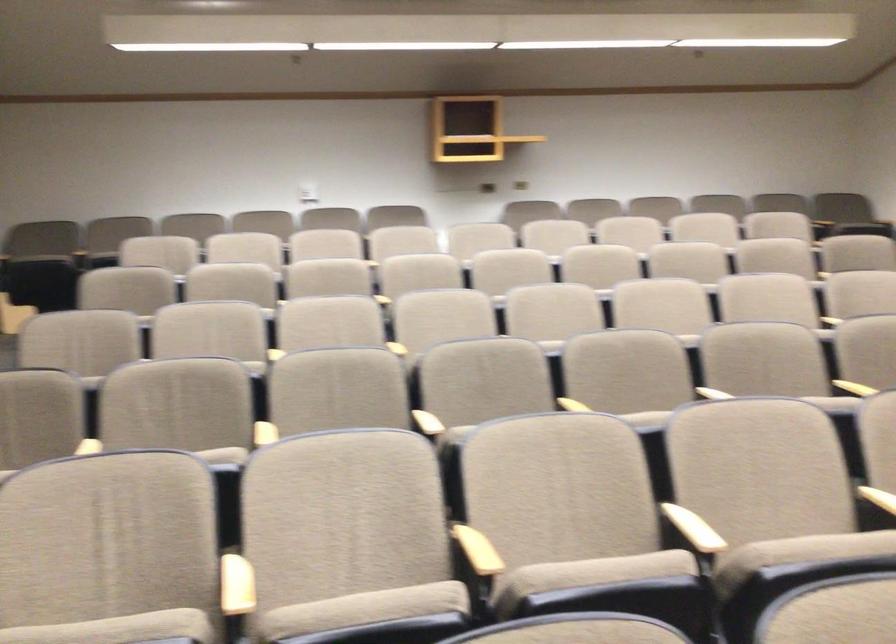
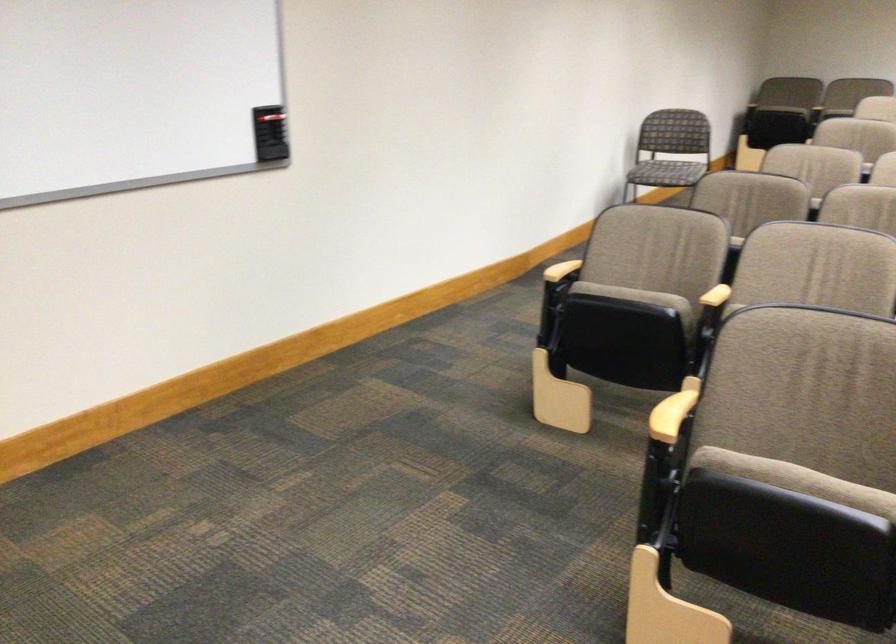
Question: I am providing you with two images of the same scene from different viewpoints. After the viewpoint changes to image2, which objects are now occluded?

Choices:
 (A) brown chair sitting surface
 (B) wooden chair armrest
 (C) small gray pouch
 (D) beige chair sitting surface

Answer: (D)